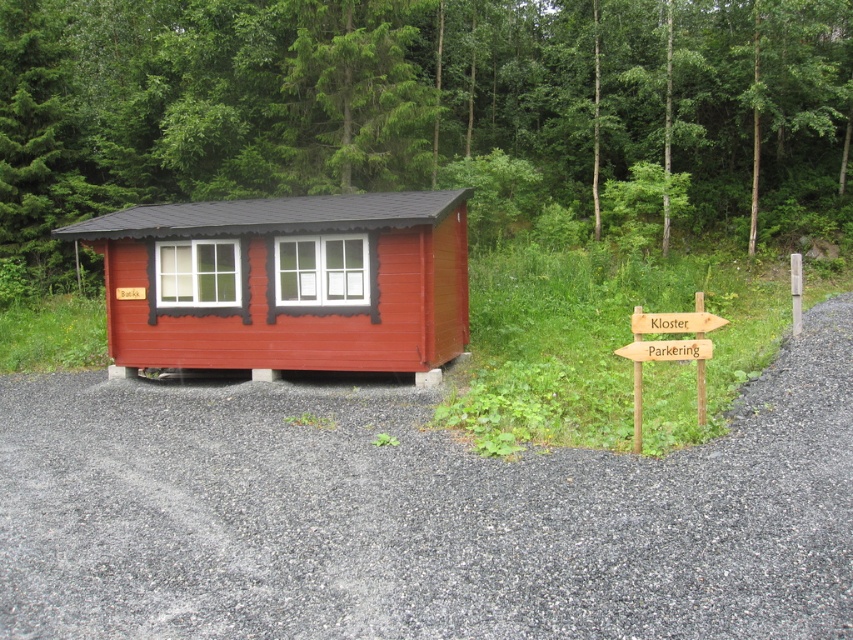
Question: Is gray gravel driveway at lower center smaller than wooden signpost at lower right?

Choices:
 (A) no
 (B) yes

Answer: (A)

Question: Is gray gravel driveway at lower center thinner than green leafy tree at upper center?

Choices:
 (A) yes
 (B) no

Answer: (A)

Question: Which object is positioned farthest from the matte wood cabin at center?

Choices:
 (A) wooden signpost at lower right
 (B) green leafy tree at upper center

Answer: (B)

Question: Which point is farther to the camera?

Choices:
 (A) wooden signpost at lower right
 (B) green leafy tree at upper center
 (C) matte wood cabin at center

Answer: (B)

Question: Based on their relative distances, which object is nearer to the green leafy tree at upper center?

Choices:
 (A) gray gravel driveway at lower center
 (B) matte wood cabin at center
 (C) wooden signpost at lower right

Answer: (B)

Question: Can you confirm if matte wood cabin at center is wider than wooden signpost at lower right?

Choices:
 (A) yes
 (B) no

Answer: (A)